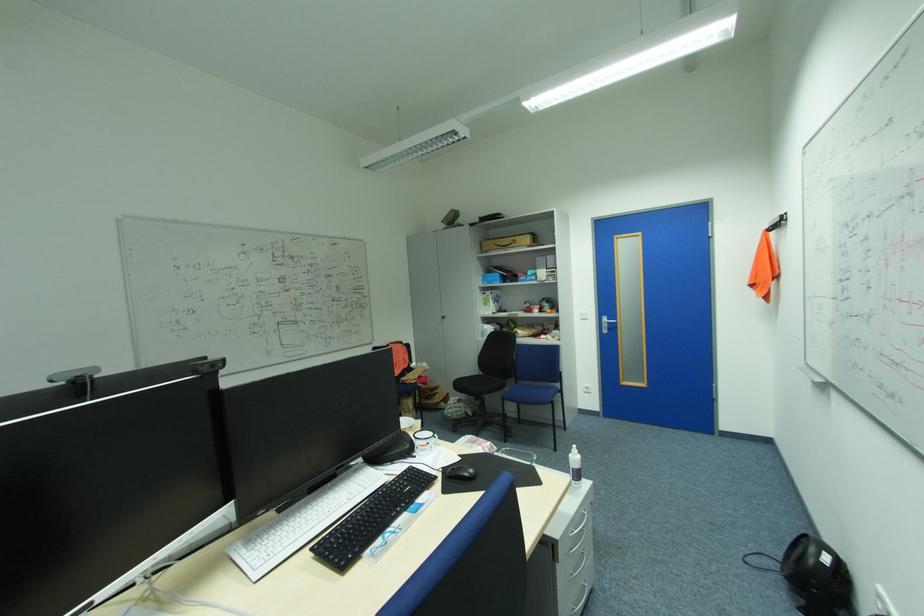
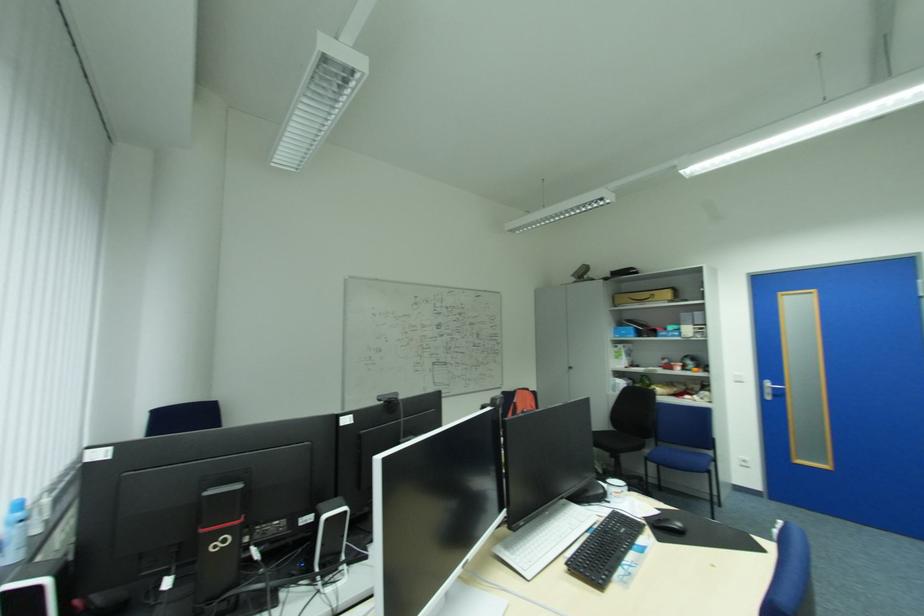
Find the pixel in the second image that matches point (318, 549) in the first image.

(573, 565)